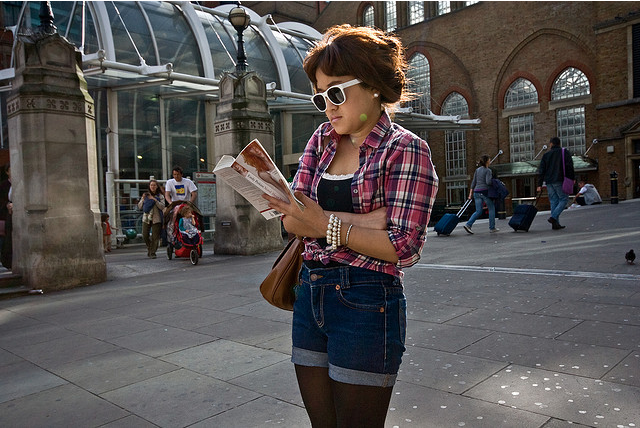
Find the location of a particular element. windows is located at coordinates (566, 118), (524, 123), (450, 143), (571, 81), (522, 91), (452, 101).